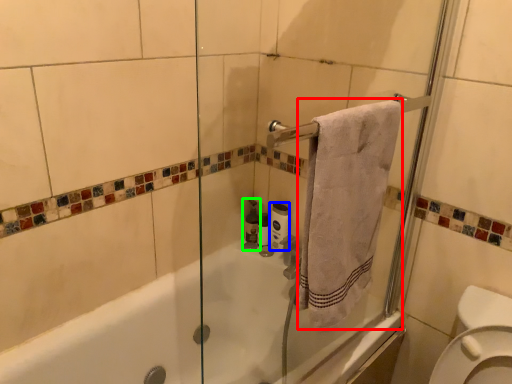
Question: Estimate the real-world distances between objects in this image. Which object is closer to bath towel (highlighted by a red box), toilet paper (highlighted by a blue box) or toiletry (highlighted by a green box)?

Choices:
 (A) toilet paper
 (B) toiletry

Answer: (A)